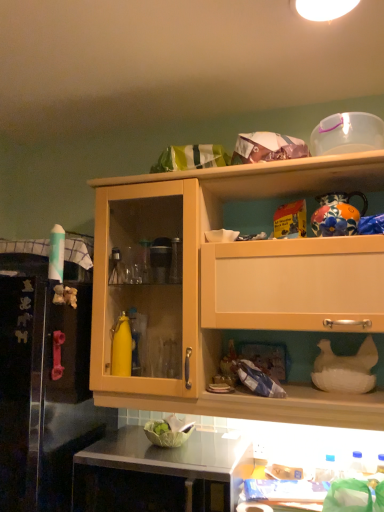
The image size is (384, 512). I want to click on free spot above white matte chicken at lower right, which is the 1th appliance from bottom to top (from a real-world perspective), so click(334, 331).